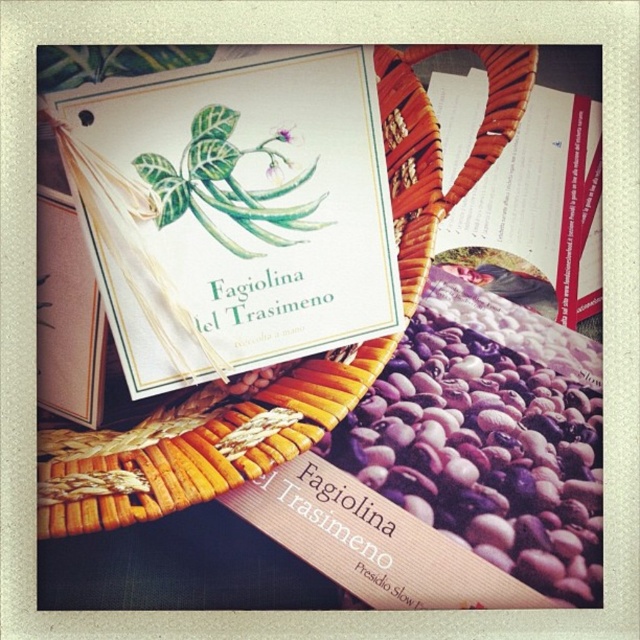
Question: Does woven brown basket at center appear on the left side of matte paper book at upper right?

Choices:
 (A) no
 (B) yes

Answer: (B)

Question: Among these points, which one is farthest from the camera?

Choices:
 (A) (198, 467)
 (B) (436, 236)

Answer: (B)

Question: Can you confirm if woven brown basket at center is positioned to the left of matte paper book at upper right?

Choices:
 (A) yes
 (B) no

Answer: (A)

Question: Does woven brown basket at center appear on the left side of matte paper book at upper right?

Choices:
 (A) yes
 (B) no

Answer: (A)

Question: Which of the following is the closest to the observer?

Choices:
 (A) woven brown basket at center
 (B) matte paper book at upper right

Answer: (A)